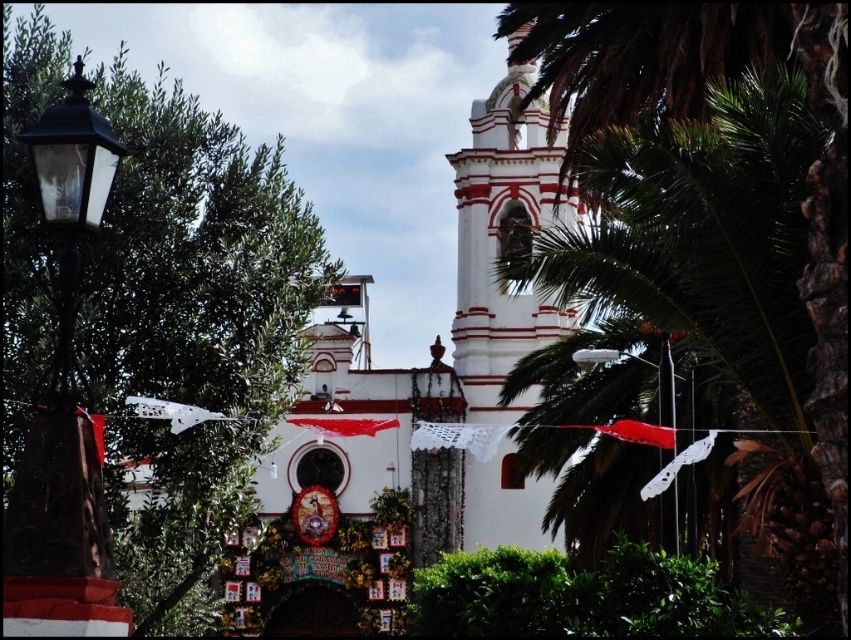
Does green leafy tree at left have a greater width compared to white glossy streetlamp at center?

Yes.

In order to click on green leafy tree at left in this screenshot , I will do `click(189, 324)`.

Which is in front, point (101, 273) or point (674, 488)?

Point (674, 488) is in front.

Find the location of `green leafy tree at left`. green leafy tree at left is located at coordinates (189, 324).

The image size is (851, 640). Find the location of `green leafy palm tree at center`. green leafy palm tree at center is located at coordinates (714, 275).

At what (x,y) coordinates should I click in order to perform the action: click on green leafy palm tree at center. Please return your answer as a coordinate pair (x, y). Looking at the image, I should click on (714, 275).

Identify the location of green leafy palm tree at center. (714, 275).

Consider the image. Can you confirm if green leafy tree at left is shorter than green leafy palm tree at center?

In fact, green leafy tree at left may be taller than green leafy palm tree at center.

What do you see at coordinates (189, 324) in the screenshot? Image resolution: width=851 pixels, height=640 pixels. I see `green leafy tree at left` at bounding box center [189, 324].

Locate an element on the screen. The width and height of the screenshot is (851, 640). green leafy tree at left is located at coordinates (189, 324).